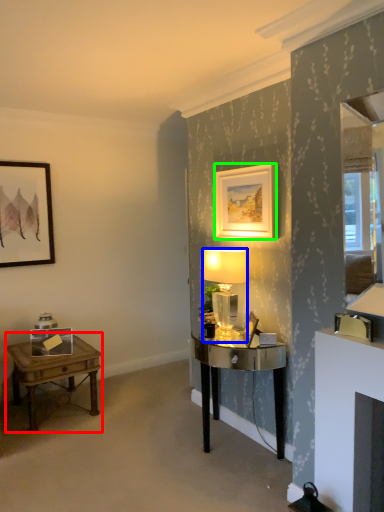
Question: Which object is the farthest from table (highlighted by a red box)? Choose among these: lamp (highlighted by a blue box) or picture frame (highlighted by a green box).

Choices:
 (A) lamp
 (B) picture frame

Answer: (B)